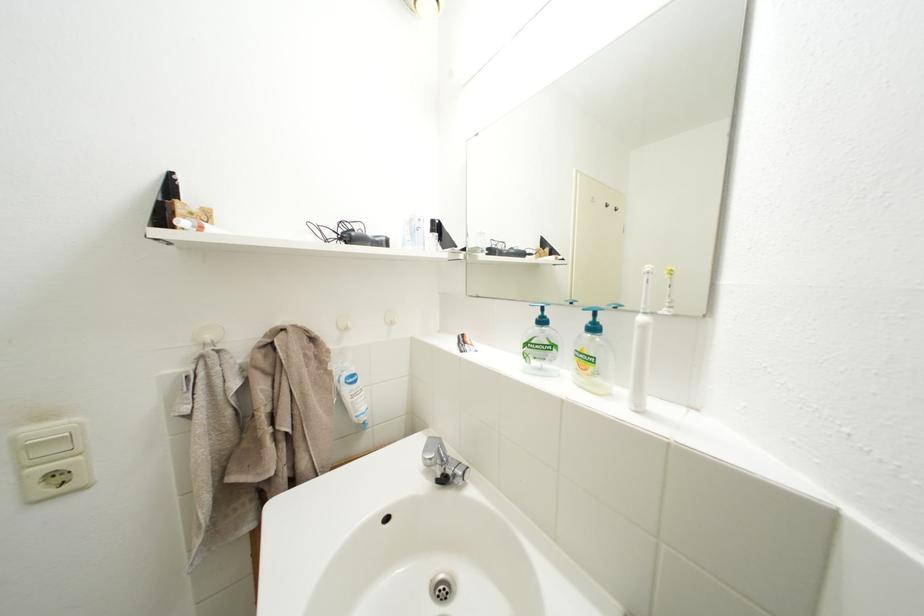
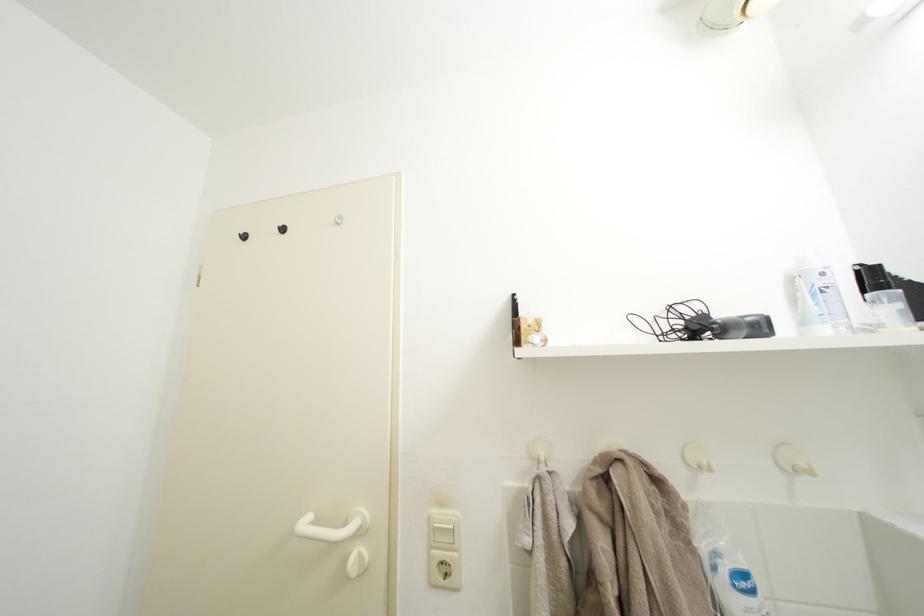
The point at (30, 484) is marked in the first image. Where is the corresponding point in the second image?

(439, 562)